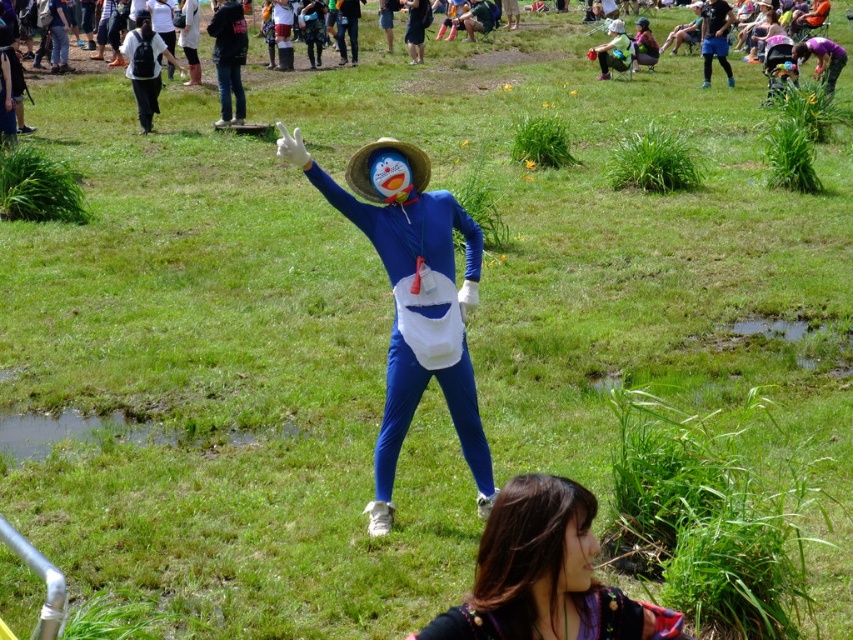
Question: Which point appears farthest from the camera in this image?

Choices:
 (A) (546, 516)
 (B) (351, 161)

Answer: (B)

Question: Is blue matte costume at center above dark brown hair at lower center?

Choices:
 (A) no
 (B) yes

Answer: (B)

Question: Is blue matte costume at center below dark brown hair at lower center?

Choices:
 (A) yes
 (B) no

Answer: (B)

Question: Does blue matte costume at center appear over dark brown hair at lower center?

Choices:
 (A) no
 (B) yes

Answer: (B)

Question: Among these objects, which one is nearest to the camera?

Choices:
 (A) blue matte costume at center
 (B) dark brown hair at lower center

Answer: (B)